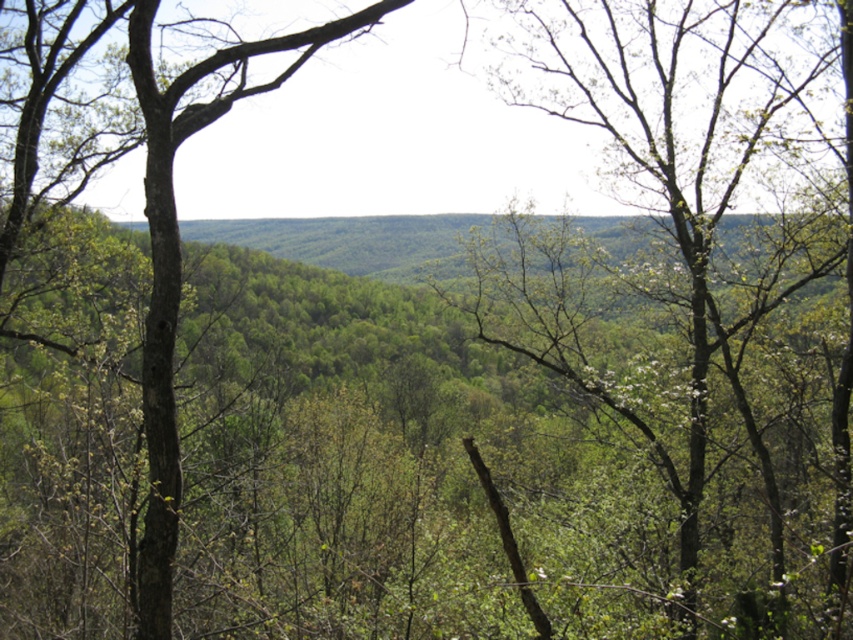
Question: Is green leafy tree at center in front of green rough bark tree at left?

Choices:
 (A) no
 (B) yes

Answer: (B)

Question: Which point is farther from the camera taking this photo?

Choices:
 (A) (723, 244)
 (B) (16, 84)

Answer: (A)

Question: Considering the relative positions of green leafy tree at center and green rough bark tree at left in the image provided, where is green leafy tree at center located with respect to green rough bark tree at left?

Choices:
 (A) right
 (B) left

Answer: (A)

Question: Is green leafy tree at center positioned behind green rough bark tree at left?

Choices:
 (A) yes
 (B) no

Answer: (B)